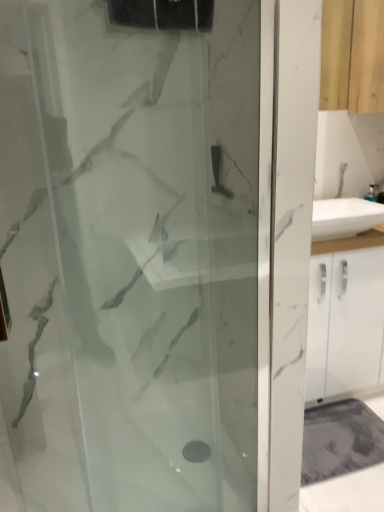
Identify the location of vacant space behind transparent glass shower door at center. The image size is (384, 512). (175, 473).